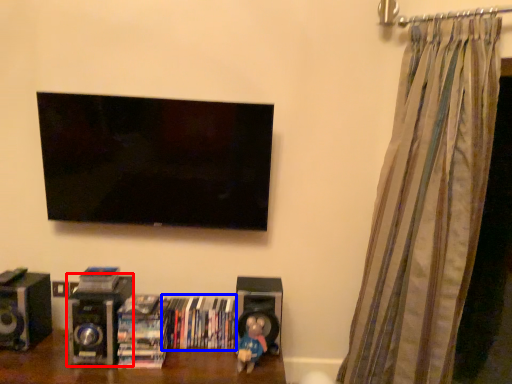
Question: Among these objects, which one is farthest to the camera, speaker (highlighted by a red box) or book (highlighted by a blue box)?

Choices:
 (A) speaker
 (B) book

Answer: (B)